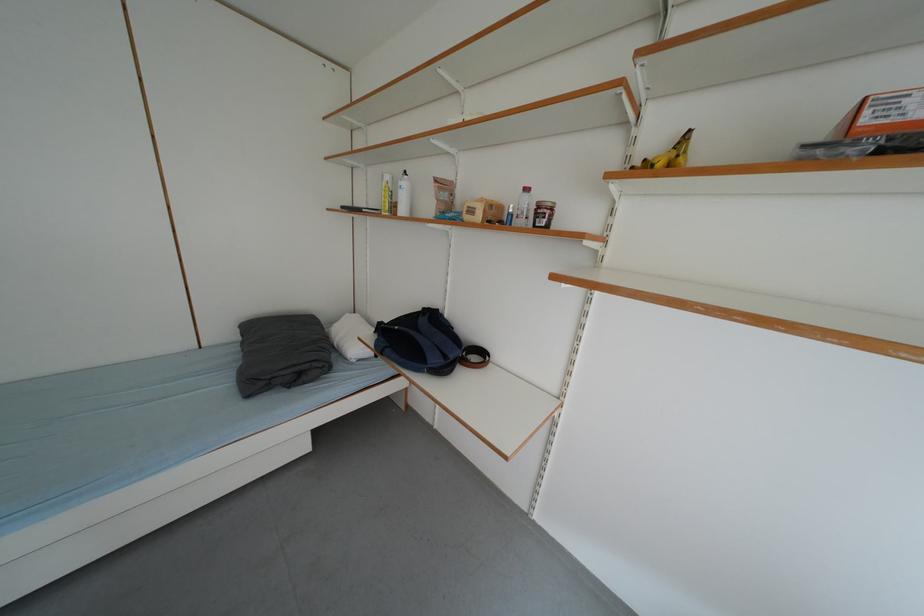
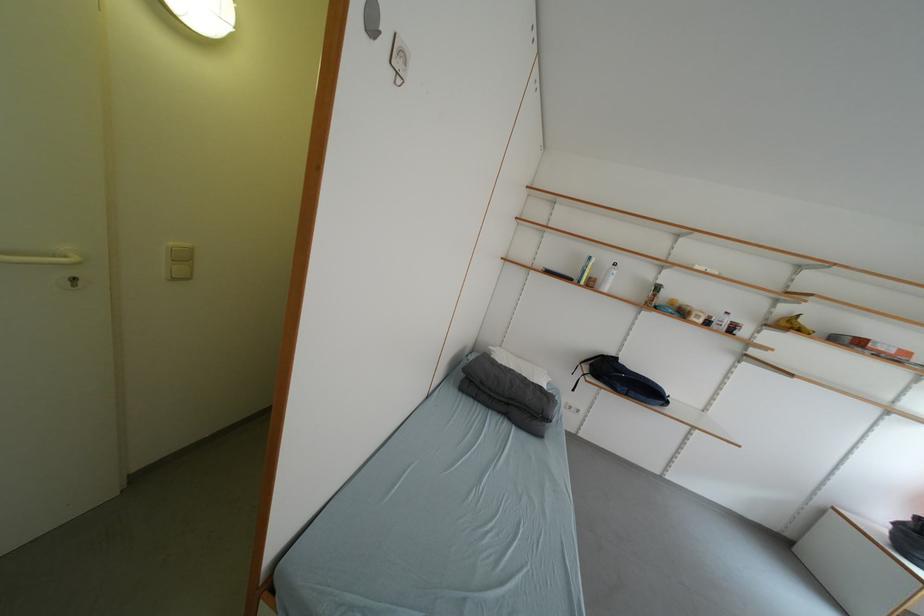
Where in the second image is the point corresponding to (396,354) from the first image?

(640, 395)